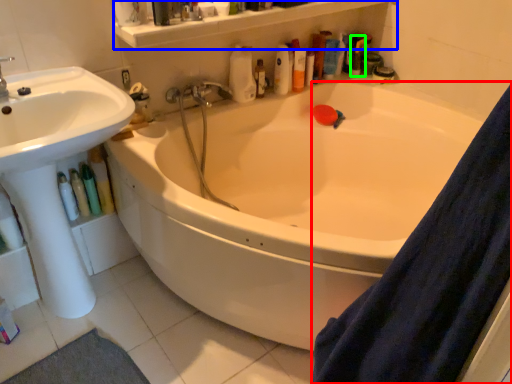
Question: Considering the real-world distances, which object is farthest from shower curtain (highlighted by a red box)? balustrade (highlighted by a blue box) or toiletry (highlighted by a green box)?

Choices:
 (A) balustrade
 (B) toiletry

Answer: (B)